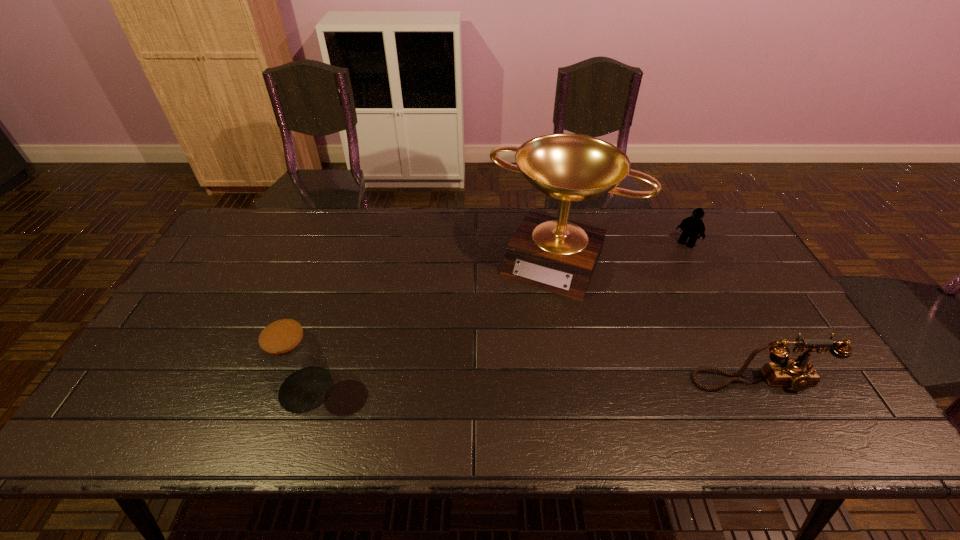
Identify the location of the third shortest object. coord(290,357).

The image size is (960, 540). Identify the location of jar. (290, 357).

Where is `telephone`? The height and width of the screenshot is (540, 960). telephone is located at coordinates (798, 373).

This screenshot has height=540, width=960. I want to click on Lego, so click(693, 226).

Identify the location of the tallest object. Image resolution: width=960 pixels, height=540 pixels. (554, 254).

The height and width of the screenshot is (540, 960). Find the location of `the third object from right to left`. the third object from right to left is located at coordinates pyautogui.click(x=554, y=254).

Locate an element on the screen. This screenshot has height=540, width=960. vacant space located on the right of the leftmost object is located at coordinates (433, 389).

Where is `vacant space located on the face of the Lego`? This screenshot has width=960, height=540. vacant space located on the face of the Lego is located at coordinates (640, 303).

Where is `vacant space located on the face of the Lego`? vacant space located on the face of the Lego is located at coordinates (673, 260).

This screenshot has height=540, width=960. I want to click on vacant space situated on the face of the Lego, so click(668, 266).